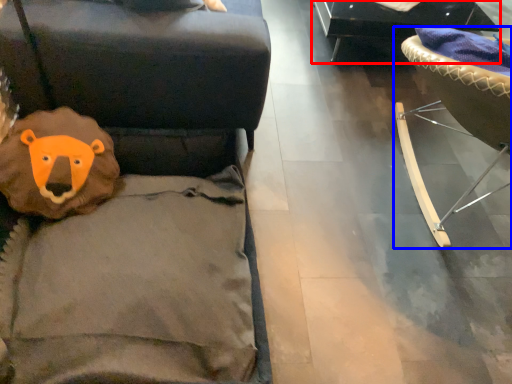
Question: Among these objects, which one is farthest to the camera, furniture (highlighted by a red box) or furniture (highlighted by a blue box)?

Choices:
 (A) furniture
 (B) furniture

Answer: (A)